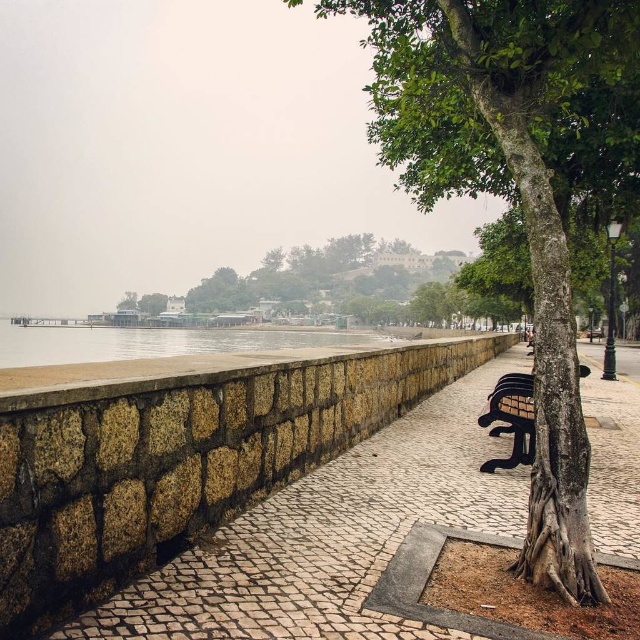
Find the location of a particular element. brown cobblestone pavement at center-left is located at coordinates (332, 534).

Does brown cobblestone pavement at center-left have a smaller size compared to green rough bark tree at center?

Yes, brown cobblestone pavement at center-left is smaller than green rough bark tree at center.

Between point (324, 566) and point (548, 236), which one is positioned in front?

Point (548, 236)

Image resolution: width=640 pixels, height=640 pixels. I want to click on brown cobblestone pavement at center-left, so click(x=332, y=534).

Is brown cobblestone pavement at center-left bigger than metallic silver bench at right?

Correct, brown cobblestone pavement at center-left is larger in size than metallic silver bench at right.

Does brown cobblestone pavement at center-left appear over metallic silver bench at right?

No.

The width and height of the screenshot is (640, 640). In order to click on brown cobblestone pavement at center-left in this screenshot , I will do `click(332, 534)`.

Which of these two, green rough bark tree at center or clear water at lower center, stands taller?

Standing taller between the two is green rough bark tree at center.

Who is more distant from viewer, (x=564, y=522) or (x=237, y=340)?

Point (x=237, y=340)

Identify the location of green rough bark tree at center. This screenshot has width=640, height=640. (524, 211).